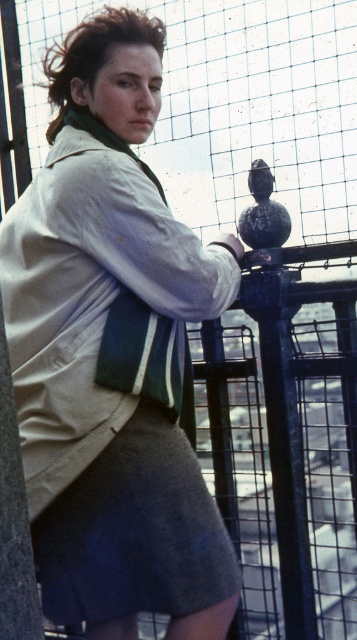
Question: Is beige cotton jacket at upper left wider than gray cotton skirt at lower center?

Choices:
 (A) no
 (B) yes

Answer: (B)

Question: Is beige cotton jacket at upper left closer to the viewer compared to gray cotton skirt at lower center?

Choices:
 (A) no
 (B) yes

Answer: (B)

Question: Does beige cotton jacket at upper left appear under gray cotton skirt at lower center?

Choices:
 (A) no
 (B) yes

Answer: (A)